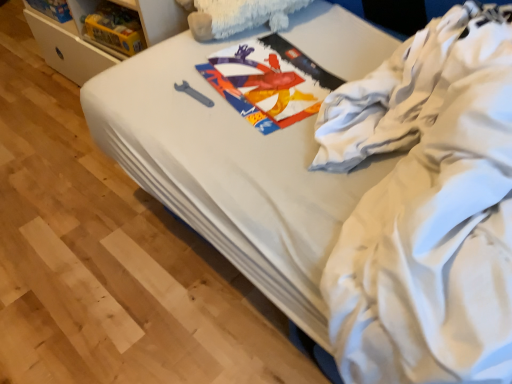
Question: Considering their positions, is gray matte wrench at center located in front of or behind white cotton shirt at upper right?

Choices:
 (A) front
 (B) behind

Answer: (B)

Question: Is gray matte wrench at center bigger or smaller than white cotton shirt at upper right?

Choices:
 (A) small
 (B) big

Answer: (A)

Question: Considering the positions of gray matte wrench at center and white cotton shirt at upper right in the image, is gray matte wrench at center taller or shorter than white cotton shirt at upper right?

Choices:
 (A) tall
 (B) short

Answer: (B)

Question: From a real-world perspective, relative to gray matte wrench at center, is white cotton shirt at upper right vertically above or below?

Choices:
 (A) above
 (B) below

Answer: (A)

Question: Do you think white cotton shirt at upper right is within gray matte wrench at center, or outside of it?

Choices:
 (A) inside
 (B) outside

Answer: (B)

Question: Considering the relative positions of white cotton shirt at upper right and gray matte wrench at center in the image provided, is white cotton shirt at upper right to the left or to the right of gray matte wrench at center?

Choices:
 (A) right
 (B) left

Answer: (A)

Question: Considering the positions of white cotton shirt at upper right and gray matte wrench at center in the image, is white cotton shirt at upper right bigger or smaller than gray matte wrench at center?

Choices:
 (A) small
 (B) big

Answer: (B)